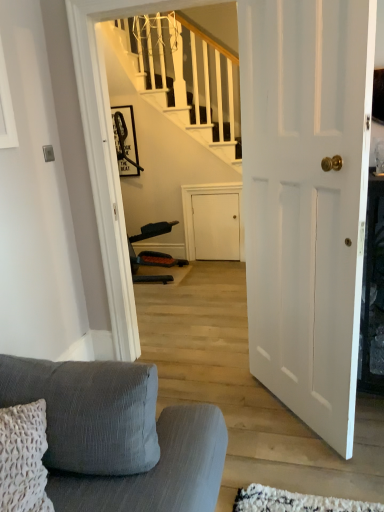
Question: Are white matte door at center and textured gray fabric couch at lower left making contact?

Choices:
 (A) no
 (B) yes

Answer: (A)

Question: Is there a large distance between white matte door at center and textured gray fabric couch at lower left?

Choices:
 (A) yes
 (B) no

Answer: (B)

Question: Is white matte door at center smaller than textured gray fabric couch at lower left?

Choices:
 (A) no
 (B) yes

Answer: (B)

Question: Does white matte door at center have a lesser height compared to textured gray fabric couch at lower left?

Choices:
 (A) no
 (B) yes

Answer: (A)

Question: Is textured gray fabric couch at lower left a part of white matte door at center?

Choices:
 (A) no
 (B) yes

Answer: (A)

Question: In terms of width, does matte black picture frame at upper center look wider or thinner when compared to white matte door at center?

Choices:
 (A) wide
 (B) thin

Answer: (B)

Question: From the image's perspective, is matte black picture frame at upper center above or below white matte door at center?

Choices:
 (A) above
 (B) below

Answer: (A)

Question: Based on their positions, is matte black picture frame at upper center located to the left or right of white matte door at center?

Choices:
 (A) right
 (B) left

Answer: (B)

Question: Is matte black picture frame at upper center in front of or behind white matte door at center in the image?

Choices:
 (A) behind
 (B) front

Answer: (A)

Question: Is white matte door at center inside or outside of textured gray fabric couch at lower left?

Choices:
 (A) inside
 (B) outside

Answer: (B)

Question: In terms of width, does white matte door at center look wider or thinner when compared to textured gray fabric couch at lower left?

Choices:
 (A) thin
 (B) wide

Answer: (A)

Question: Relative to textured gray fabric couch at lower left, is white matte door at center in front or behind?

Choices:
 (A) front
 (B) behind

Answer: (B)

Question: Visually, is white matte door at center positioned to the left or to the right of textured gray fabric couch at lower left?

Choices:
 (A) right
 (B) left

Answer: (A)

Question: Considering the positions of point (158, 439) and point (365, 89), is point (158, 439) closer or farther from the camera than point (365, 89)?

Choices:
 (A) farther
 (B) closer

Answer: (A)

Question: Is textured gray fabric couch at lower left wider or thinner than white matte door at center?

Choices:
 (A) thin
 (B) wide

Answer: (B)